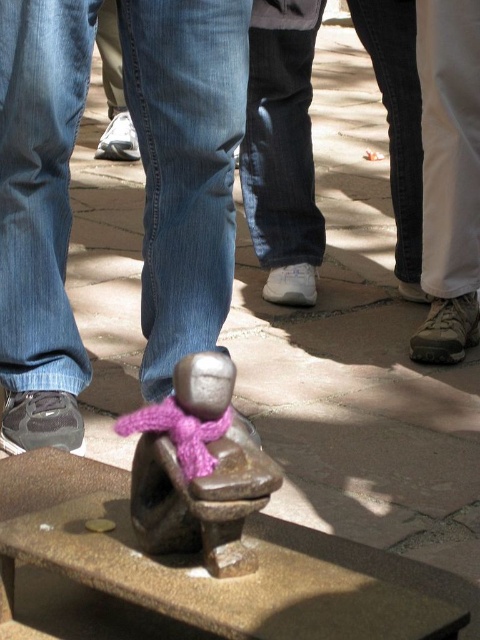
How distant is matte black shoe at lower left from white fabric shoe at lower left?

matte black shoe at lower left and white fabric shoe at lower left are 9.75 feet apart.

Find the location of `matte black shoe at lower left`. matte black shoe at lower left is located at coordinates (40, 422).

Identify the location of matte black shoe at lower left. Image resolution: width=480 pixels, height=640 pixels. (40, 422).

How much distance is there between bronze stone bench at center and white fabric pants at right?

The distance of bronze stone bench at center from white fabric pants at right is 4.96 feet.

Where is `bronze stone bench at center`? bronze stone bench at center is located at coordinates (199, 572).

The height and width of the screenshot is (640, 480). What are the coordinates of `bronze stone bench at center` in the screenshot? It's located at (199, 572).

Does white fabric pants at right lie behind matte white shoe at lower right?

No, it is not.

Can you confirm if white fabric pants at right is wider than matte white shoe at lower right?

Indeed, white fabric pants at right has a greater width compared to matte white shoe at lower right.

Is point (467, 33) positioned in front of point (407, 284)?

Yes, point (467, 33) is closer to viewer.

Where is `white fabric pants at right`? white fabric pants at right is located at coordinates (448, 177).